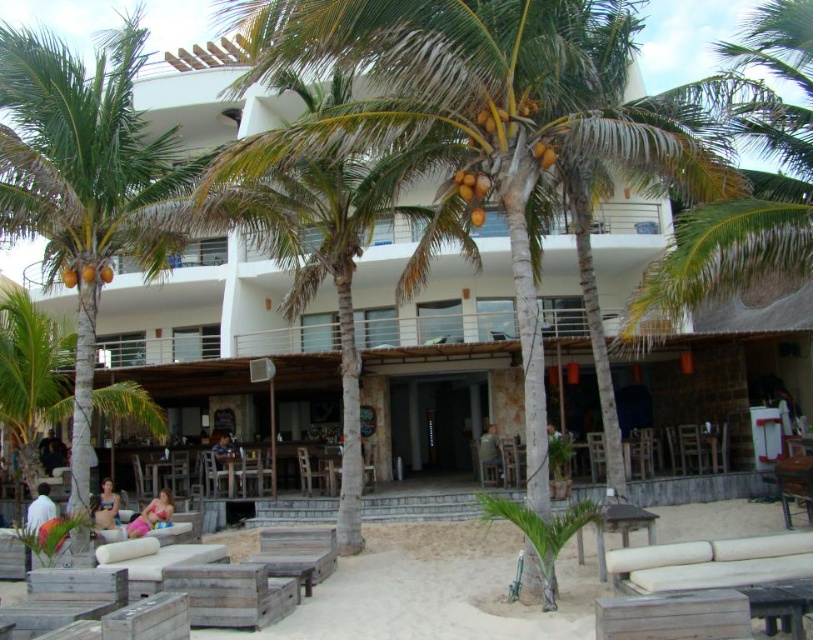
You are a photographer trying to capture both the green leafy palm tree at center and the pink fabric bikini at lower center in a single shot. Which object should you focus on first to ensure both are in frame?

You should focus on the pink fabric bikini at lower center first because the green leafy palm tree at center is smaller in size, so adjusting the frame to include the larger pink fabric bikini at lower center will naturally include the smaller palm tree as well.

You are standing at the beachfront and want to take a photo of the green leafy palm tree at center. If you are currently 53.34 feet away from it, can you capture the entire tree in your camera frame without moving closer?

The green leafy palm tree at center and viewer are 53.34 feet apart from each other. Whether you can capture the entire tree depends on your camera lens. A standard lens might require being closer, but a wide angle lens could potentially capture it from that distance.

Based on the photo, you are planning to set up a small table between the wooden lounge chairs at lower center and the wooden chair at center. Considering their sizes, which object will require more space around it to avoid overcrowding?

The wooden lounge chairs at lower center will require more space around it because it is larger in size than the wooden chair at center.